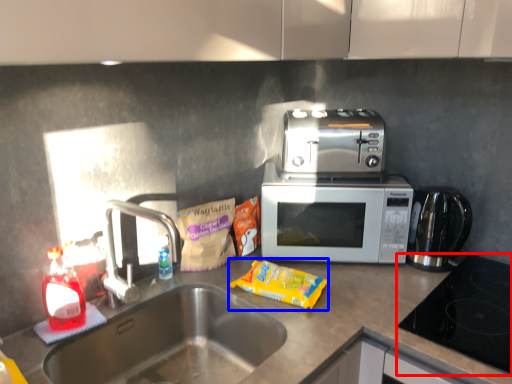
Question: Which of the following is the farthest to the observer, gas stove (highlighted by a red box) or snack (highlighted by a blue box)?

Choices:
 (A) gas stove
 (B) snack

Answer: (B)